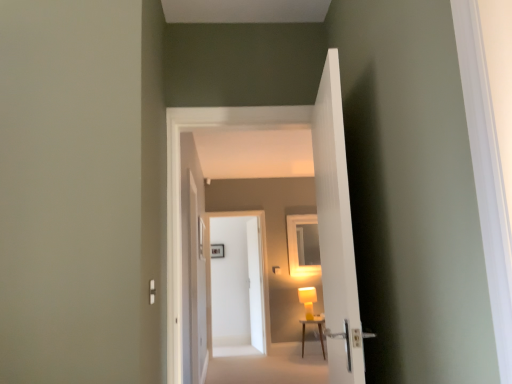
Question: Considering the relative positions of matte yellow table lamp at center and white ribbed door at center, which is the 1th door in front-to-back order, in the image provided, is matte yellow table lamp at center to the left or to the right of white ribbed door at center, which is the 1th door in front-to-back order,?

Choices:
 (A) left
 (B) right

Answer: (B)

Question: Considering the positions of matte yellow table lamp at center and white ribbed door at center, which is the 1th door in front-to-back order, in the image, is matte yellow table lamp at center wider or thinner than white ribbed door at center, which is the 1th door in front-to-back order,?

Choices:
 (A) wide
 (B) thin

Answer: (A)

Question: Which object is the farthest from the wooden table at center?

Choices:
 (A) white ribbed door at center, positioned as the 4th door in back-to-front order
 (B) matte yellow table lamp at center
 (C) white carpet at lower center
 (D) white glossy door at center, marked as the third door in a front-to-back arrangement
 (E) white glossy door at center, which ranks as the third door in back-to-front order

Answer: (A)

Question: Based on their relative distances, which object is nearer to the wooden table at center?

Choices:
 (A) white carpet at lower center
 (B) white glossy door at center, which is the second door in back-to-front order
 (C) matte yellow table lamp at center
 (D) white ribbed door at center, positioned as the 4th door in back-to-front order
 (E) white glossy door at center, arranged as the 2th door when viewed from the front

Answer: (C)